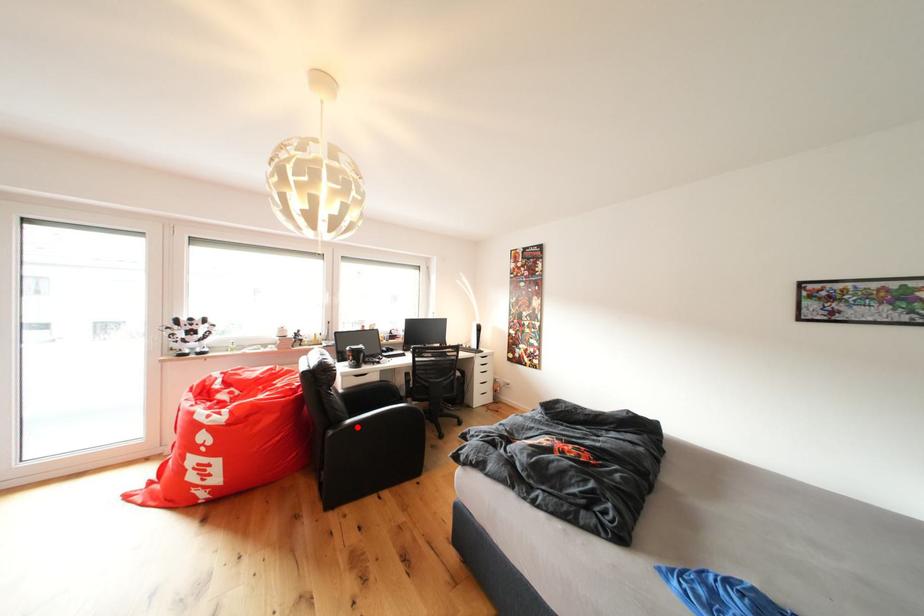
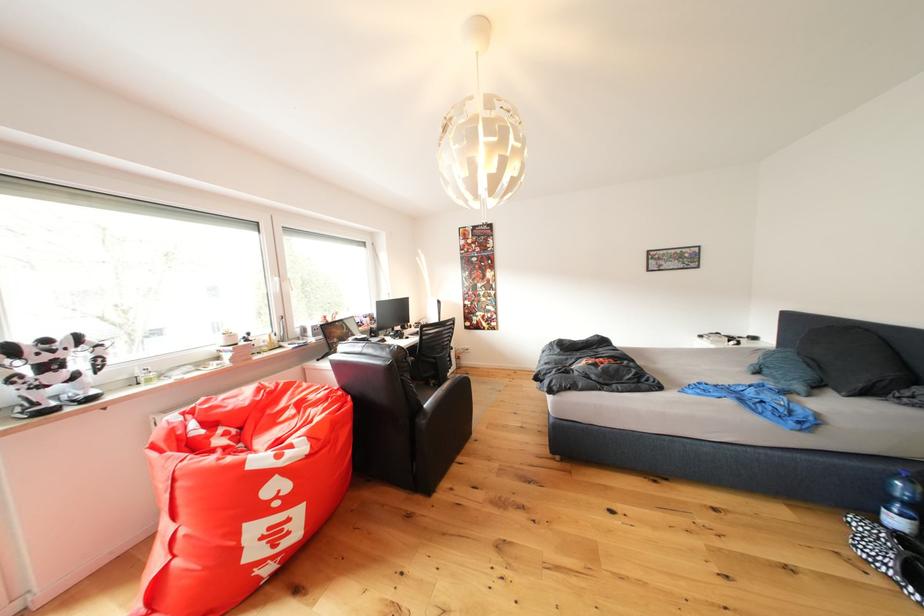
Question: I am providing you with two images of the same scene from different viewpoints. A red point is shown in image1. For the corresponding object point in image2, is it positioned nearer or farther from the camera?

Choices:
 (A) Nearer
 (B) Farther

Answer: (A)